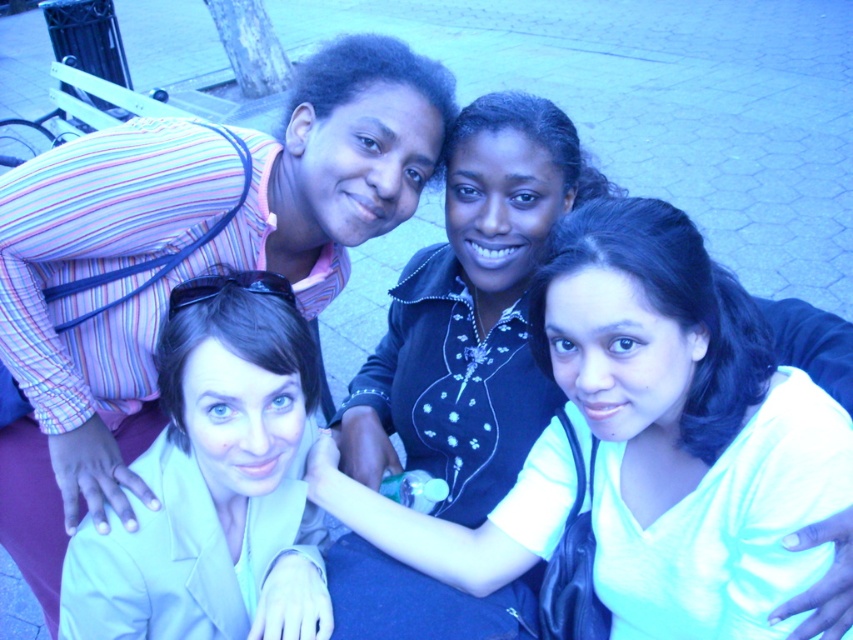
Question: Can you confirm if light blue fabric at center is positioned to the right of light beige fabric at lower left?

Choices:
 (A) yes
 (B) no

Answer: (A)

Question: Which of the following is the closest to the observer?

Choices:
 (A) light blue fabric at center
 (B) light beige fabric at lower left

Answer: (A)

Question: Where is light blue fabric at center located in relation to light beige fabric at lower left in the image?

Choices:
 (A) right
 (B) left

Answer: (A)

Question: Among these points, which one is nearest to the camera?

Choices:
 (A) (219, 346)
 (B) (701, 410)

Answer: (A)

Question: Is light blue fabric at center below light beige fabric at lower left?

Choices:
 (A) no
 (B) yes

Answer: (A)